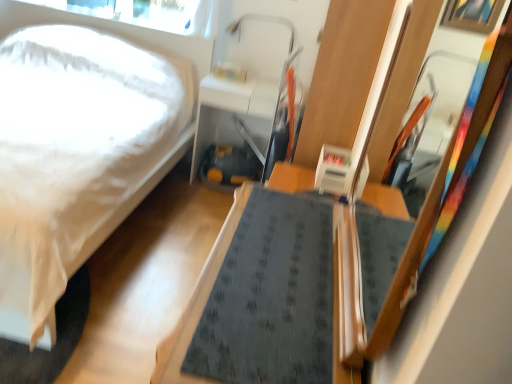
Question: Is matte white table at center, acting as the second table starting from the bottom, completely or partially inside wooden framed mirror at right?

Choices:
 (A) no
 (B) yes

Answer: (A)

Question: Is wooden framed mirror at right positioned in front of matte white table at center, positioned as the first table in back-to-front order?

Choices:
 (A) no
 (B) yes

Answer: (B)

Question: Does wooden framed mirror at right have a greater width compared to matte white table at center, marked as the first table in a top-to-bottom arrangement?

Choices:
 (A) yes
 (B) no

Answer: (B)

Question: Would you say wooden framed mirror at right is a long distance from matte white table at center, marked as the first table in a top-to-bottom arrangement?

Choices:
 (A) no
 (B) yes

Answer: (B)

Question: Is wooden framed mirror at right looking in the opposite direction of matte white table at center, acting as the second table starting from the bottom?

Choices:
 (A) no
 (B) yes

Answer: (A)

Question: Do you think matte white table at center, positioned as the first table in back-to-front order, is within transparent glass window screen at upper left, or outside of it?

Choices:
 (A) inside
 (B) outside

Answer: (B)

Question: Considering the positions of point (231, 104) and point (70, 8), is point (231, 104) closer or farther from the camera than point (70, 8)?

Choices:
 (A) closer
 (B) farther

Answer: (A)

Question: Based on their positions, is matte white table at center, marked as the first table in a top-to-bottom arrangement, located to the left or right of transparent glass window screen at upper left?

Choices:
 (A) right
 (B) left

Answer: (A)

Question: Relative to transparent glass window screen at upper left, is matte white table at center, positioned as the first table in back-to-front order, in front or behind?

Choices:
 (A) behind
 (B) front

Answer: (B)

Question: Looking at their shapes, would you say transparent glass window screen at upper left is wider or thinner than wooden framed mirror at right?

Choices:
 (A) thin
 (B) wide

Answer: (A)

Question: From a real-world perspective, is transparent glass window screen at upper left above or below wooden framed mirror at right?

Choices:
 (A) below
 (B) above

Answer: (A)

Question: In terms of height, does transparent glass window screen at upper left look taller or shorter compared to wooden framed mirror at right?

Choices:
 (A) tall
 (B) short

Answer: (B)

Question: In the image, is transparent glass window screen at upper left positioned in front of or behind wooden framed mirror at right?

Choices:
 (A) front
 (B) behind

Answer: (B)

Question: Relative to transparent glass window screen at upper left, is wooden framed mirror at right in front or behind?

Choices:
 (A) behind
 (B) front

Answer: (B)

Question: Would you say wooden framed mirror at right is to the left or to the right of transparent glass window screen at upper left in the picture?

Choices:
 (A) right
 (B) left

Answer: (A)